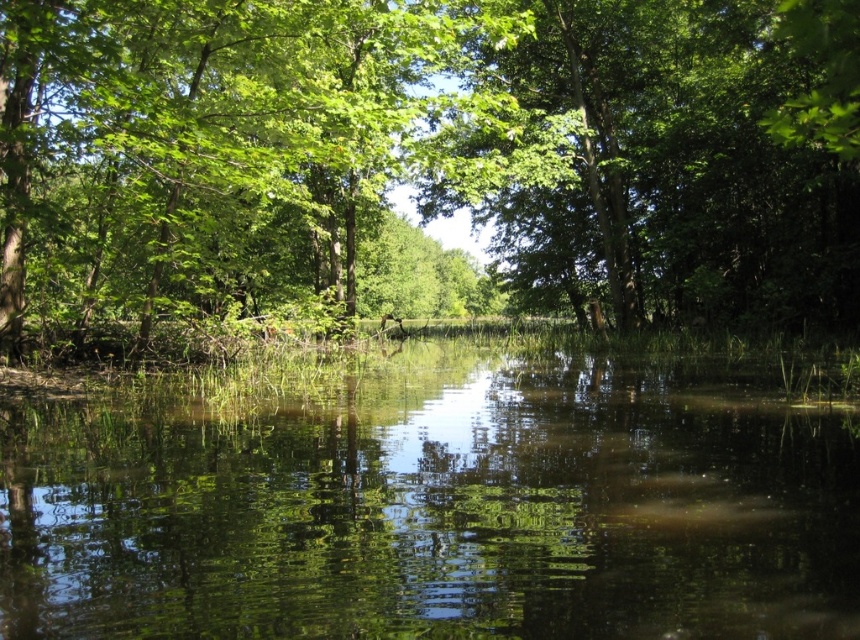
Identify the location of green leafy tree at center. The height and width of the screenshot is (640, 860). (427, 160).

Is green leafy tree at center to the left of green reflective water at center from the viewer's perspective?

No, green leafy tree at center is not to the left of green reflective water at center.

Which is behind, point (659, 116) or point (115, 472)?

The point (659, 116) is more distant.

Identify the location of green leafy tree at center. (427, 160).